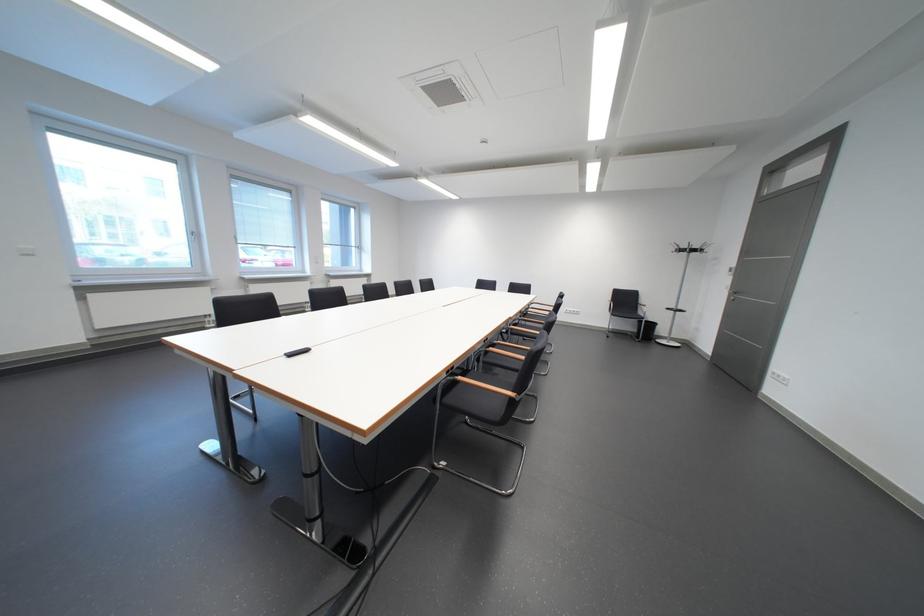
Find where to lift the black trash can. Please return your answer as a coordinate pair (x, y).

(646, 330)